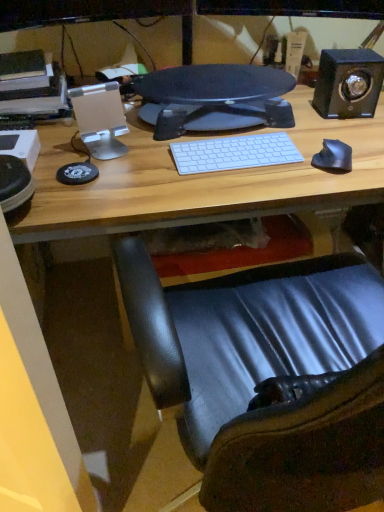
Question: Is black matte speaker at upper right thinner than black textured monitor at center?

Choices:
 (A) no
 (B) yes

Answer: (B)

Question: Is black matte speaker at upper right facing away from black textured monitor at center?

Choices:
 (A) yes
 (B) no

Answer: (B)

Question: Is black textured monitor at center surrounded by black matte speaker at upper right?

Choices:
 (A) yes
 (B) no

Answer: (B)

Question: From the image's perspective, is black matte speaker at upper right beneath black textured monitor at center?

Choices:
 (A) no
 (B) yes

Answer: (A)

Question: Considering the relative positions of black matte speaker at upper right and black textured monitor at center in the image provided, is black matte speaker at upper right to the right of black textured monitor at center from the viewer's perspective?

Choices:
 (A) no
 (B) yes

Answer: (B)

Question: Considering the relative sizes of black matte speaker at upper right and black textured monitor at center in the image provided, is black matte speaker at upper right wider than black textured monitor at center?

Choices:
 (A) no
 (B) yes

Answer: (A)

Question: Is black textured monitor at center in front of shiny black mouse at right?

Choices:
 (A) no
 (B) yes

Answer: (A)

Question: Can we say black textured monitor at center lies outside shiny black mouse at right?

Choices:
 (A) yes
 (B) no

Answer: (A)

Question: Can you confirm if black textured monitor at center is shorter than shiny black mouse at right?

Choices:
 (A) yes
 (B) no

Answer: (B)

Question: Is black textured monitor at center looking in the opposite direction of shiny black mouse at right?

Choices:
 (A) no
 (B) yes

Answer: (A)

Question: Can you confirm if black textured monitor at center is bigger than shiny black mouse at right?

Choices:
 (A) no
 (B) yes

Answer: (B)

Question: Is black textured monitor at center to the right of shiny black mouse at right from the viewer's perspective?

Choices:
 (A) no
 (B) yes

Answer: (A)

Question: Is shiny black mouse at right wider than black textured monitor at center?

Choices:
 (A) no
 (B) yes

Answer: (A)